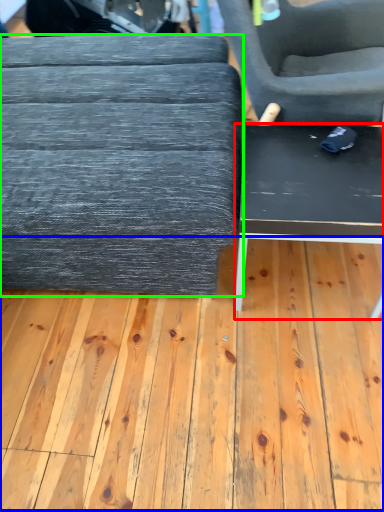
Question: Which object is positioned closest to table (highlighted by a red box)? Select from plywood (highlighted by a blue box) and table (highlighted by a green box).

Choices:
 (A) plywood
 (B) table

Answer: (B)